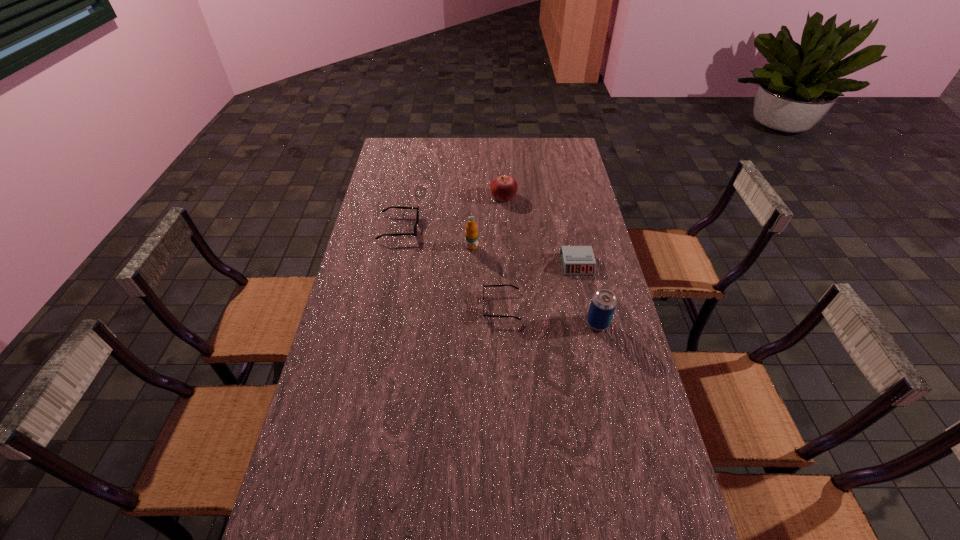
Considering the uniform spacing of sunglassess, where should an additional sunglasses be positioned on the right? Please locate a free spot. Please provide its 2D coordinates. Your answer should be formatted as a tuple, i.e. [(x, y)], where the tuple contains the x and y coordinates of a point satisfying the conditions above.

[(654, 422)]